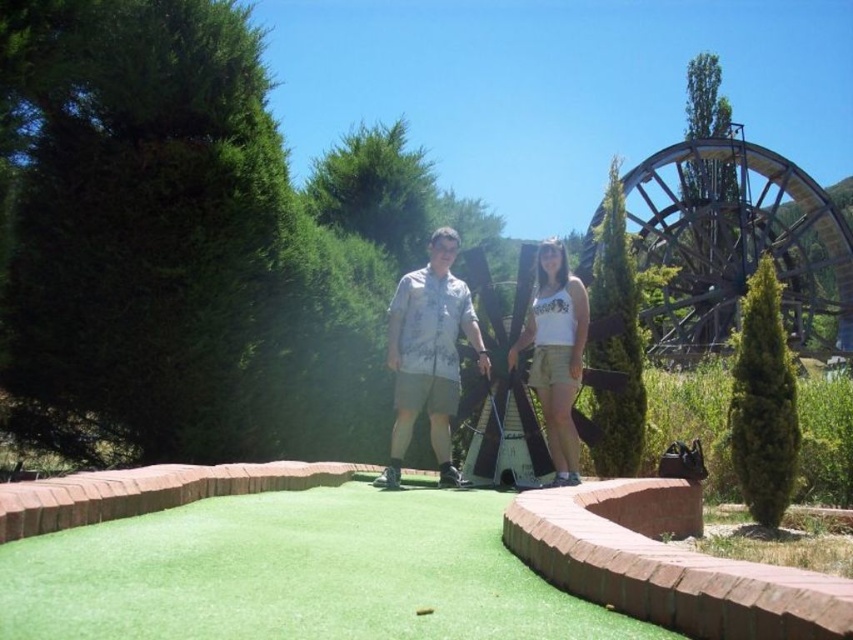
Is green artificial turf at center to the right of white cotton tank top at center from the viewer's perspective?

Incorrect, green artificial turf at center is not on the right side of white cotton tank top at center.

Between green artificial turf at center and white cotton tank top at center, which one has less height?

Standing shorter between the two is green artificial turf at center.

Where is `green artificial turf at center`? Image resolution: width=853 pixels, height=640 pixels. green artificial turf at center is located at coordinates (294, 573).

You are a GUI agent. You are given a task and a screenshot of the screen. Output one action in this format:
    pyautogui.click(x=<x>, y=<y>)
    Task: Click on the green artificial turf at center
    The image size is (853, 640).
    Given the screenshot: What is the action you would take?
    tap(294, 573)

Measure the distance between light gray shirt at center and camera.

light gray shirt at center is 21.21 meters away from camera.

Which is more to the left, light gray shirt at center or white cotton tank top at center?

From the viewer's perspective, light gray shirt at center appears more on the left side.

Is point (392, 458) positioned after point (560, 372)?

No.

Identify the location of light gray shirt at center. The height and width of the screenshot is (640, 853). (428, 355).

Locate an element on the screen. The height and width of the screenshot is (640, 853). green artificial turf at center is located at coordinates (294, 573).

Which of these two, green artificial turf at center or light gray shirt at center, stands taller?

green artificial turf at center

Which is in front, point (242, 531) or point (393, 321)?

Point (242, 531)

The image size is (853, 640). I want to click on green artificial turf at center, so click(x=294, y=573).